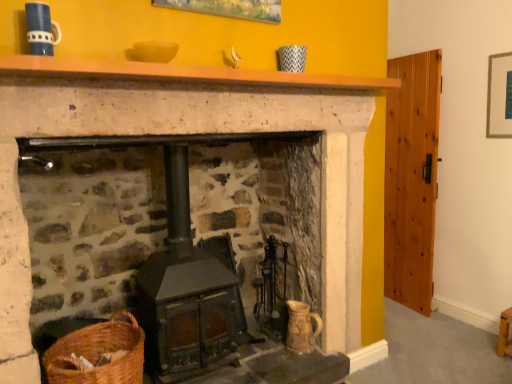
Question: Considering the relative positions of wooden mantle at upper center and metallic silver picture frame at upper right in the image provided, is wooden mantle at upper center behind metallic silver picture frame at upper right?

Choices:
 (A) yes
 (B) no

Answer: (B)

Question: Does wooden mantle at upper center have a greater height compared to metallic silver picture frame at upper right?

Choices:
 (A) yes
 (B) no

Answer: (B)

Question: Does wooden mantle at upper center have a larger size compared to metallic silver picture frame at upper right?

Choices:
 (A) no
 (B) yes

Answer: (B)

Question: Considering the relative sizes of wooden mantle at upper center and metallic silver picture frame at upper right in the image provided, is wooden mantle at upper center smaller than metallic silver picture frame at upper right?

Choices:
 (A) no
 (B) yes

Answer: (A)

Question: From the image's perspective, is wooden mantle at upper center located beneath metallic silver picture frame at upper right?

Choices:
 (A) yes
 (B) no

Answer: (A)

Question: Would you say wooden mantle at upper center is a long distance from metallic silver picture frame at upper right?

Choices:
 (A) yes
 (B) no

Answer: (A)

Question: Is the position of wooden stool at lower right less distant than that of metallic silver picture frame at upper right?

Choices:
 (A) yes
 (B) no

Answer: (A)

Question: From the image's perspective, would you say wooden stool at lower right is shown under metallic silver picture frame at upper right?

Choices:
 (A) yes
 (B) no

Answer: (A)

Question: Does wooden stool at lower right have a smaller size compared to metallic silver picture frame at upper right?

Choices:
 (A) yes
 (B) no

Answer: (B)

Question: Is the surface of wooden stool at lower right in direct contact with metallic silver picture frame at upper right?

Choices:
 (A) no
 (B) yes

Answer: (A)

Question: Considering the relative sizes of wooden stool at lower right and metallic silver picture frame at upper right in the image provided, is wooden stool at lower right wider than metallic silver picture frame at upper right?

Choices:
 (A) yes
 (B) no

Answer: (A)

Question: Is wooden stool at lower right further to camera compared to metallic silver picture frame at upper right?

Choices:
 (A) no
 (B) yes

Answer: (A)

Question: Can you confirm if rustic wood stove at center is positioned to the right of woven brown basket at lower left?

Choices:
 (A) no
 (B) yes

Answer: (B)